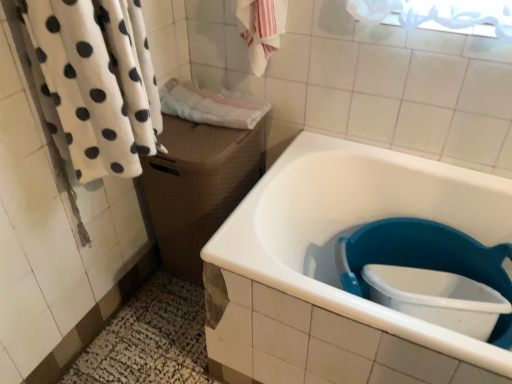
Question: Can we say white glossy bathtub at lower right lies outside pink terry cloth towel at center, marked as the first bath towel in a back-to-front arrangement?

Choices:
 (A) yes
 (B) no

Answer: (A)

Question: Considering the relative sizes of white glossy bathtub at lower right and pink terry cloth towel at center, marked as the first bath towel in a back-to-front arrangement, in the image provided, is white glossy bathtub at lower right thinner than pink terry cloth towel at center, marked as the first bath towel in a back-to-front arrangement,?

Choices:
 (A) no
 (B) yes

Answer: (A)

Question: Is white glossy bathtub at lower right facing towards pink terry cloth towel at center, the third bath towel in the front-to-back sequence?

Choices:
 (A) yes
 (B) no

Answer: (B)

Question: Does white glossy bathtub at lower right have a smaller size compared to pink terry cloth towel at center, marked as the first bath towel in a back-to-front arrangement?

Choices:
 (A) no
 (B) yes

Answer: (A)

Question: Is white glossy bathtub at lower right positioned behind pink terry cloth towel at center, the third bath towel in the front-to-back sequence?

Choices:
 (A) yes
 (B) no

Answer: (B)

Question: Would you say white glossy bathtub at lower right is to the left or to the right of pink terry cloth towel at center, the third bath towel in the front-to-back sequence, in the picture?

Choices:
 (A) left
 (B) right

Answer: (B)

Question: Is white glossy bathtub at lower right inside the boundaries of pink terry cloth towel at center, the third bath towel in the front-to-back sequence, or outside?

Choices:
 (A) inside
 (B) outside

Answer: (B)

Question: Considering their positions, is white glossy bathtub at lower right located in front of or behind pink terry cloth towel at center, marked as the first bath towel in a back-to-front arrangement?

Choices:
 (A) front
 (B) behind

Answer: (A)

Question: Is point (252, 200) positioned closer to the camera than point (203, 112)?

Choices:
 (A) farther
 (B) closer

Answer: (B)

Question: Relative to brown woven box at center, is pink terry cloth towel at center, marked as the first bath towel in a back-to-front arrangement, in front or behind?

Choices:
 (A) front
 (B) behind

Answer: (B)

Question: Is pink terry cloth towel at center, the third bath towel in the front-to-back sequence, taller or shorter than brown woven box at center?

Choices:
 (A) short
 (B) tall

Answer: (A)

Question: Based on their positions, is pink terry cloth towel at center, marked as the first bath towel in a back-to-front arrangement, located to the left or right of brown woven box at center?

Choices:
 (A) right
 (B) left

Answer: (A)

Question: Based on their sizes in the image, would you say pink terry cloth towel at center, the third bath towel in the front-to-back sequence, is bigger or smaller than brown woven box at center?

Choices:
 (A) small
 (B) big

Answer: (A)

Question: From a real-world perspective, relative to white fluffy towel at left, which appears as the 1th bath towel when viewed from the front, is white glossy bathtub at lower right vertically above or below?

Choices:
 (A) above
 (B) below

Answer: (B)

Question: From the image's perspective, is white glossy bathtub at lower right located above or below white fluffy towel at left, arranged as the 3th bath towel when viewed from the back?

Choices:
 (A) below
 (B) above

Answer: (A)